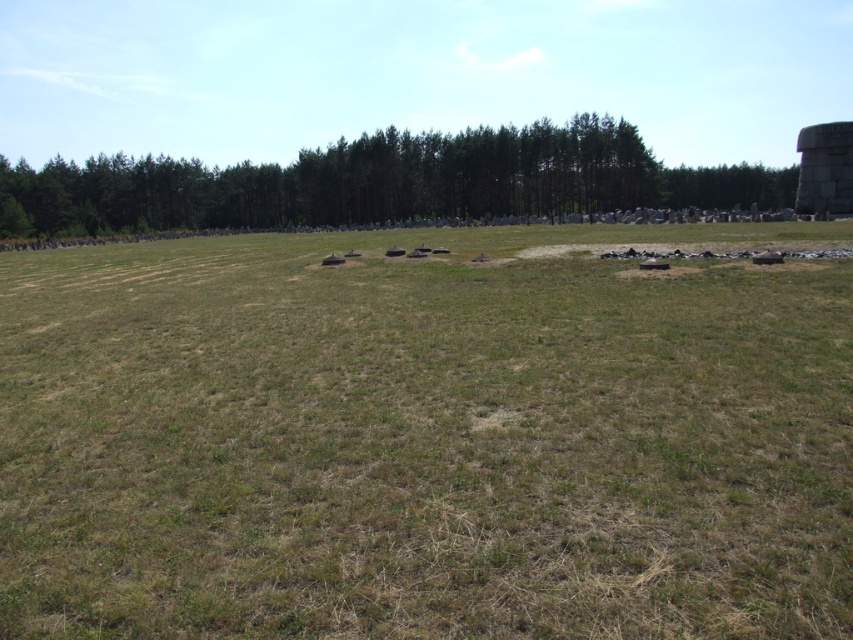
Can you confirm if green grass at center is thinner than green leafy trees at center?

Yes, green grass at center is thinner than green leafy trees at center.

Identify the location of green grass at center. (424, 440).

I want to click on green grass at center, so click(424, 440).